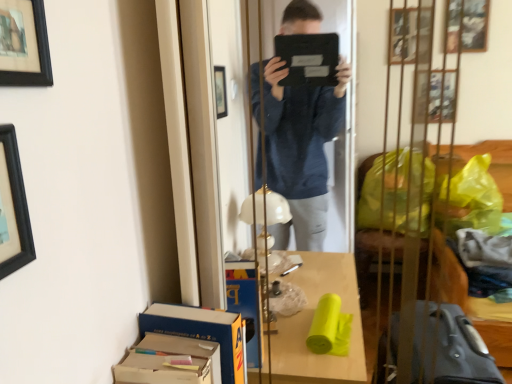
Question: From a real-world perspective, is cardboard box at lower left, arranged as the 2th cardboard box when viewed from the back, under black matte picture frame at upper left, which appears as the 1th picture frame when viewed from the top?

Choices:
 (A) yes
 (B) no

Answer: (A)

Question: Is cardboard box at lower left, arranged as the 2th cardboard box when viewed from the back, looking in the opposite direction of black matte picture frame at upper left, which appears as the 1th picture frame when viewed from the top?

Choices:
 (A) no
 (B) yes

Answer: (A)

Question: Can you confirm if cardboard box at lower left, arranged as the 2th cardboard box when viewed from the back, is positioned to the left of black matte picture frame at upper left, acting as the 2th picture frame starting from the bottom?

Choices:
 (A) no
 (B) yes

Answer: (A)

Question: Can you confirm if cardboard box at lower left, arranged as the 2th cardboard box when viewed from the back, is wider than black matte picture frame at upper left, which appears as the 1th picture frame when viewed from the top?

Choices:
 (A) yes
 (B) no

Answer: (A)

Question: Is cardboard box at lower left, arranged as the 2th cardboard box when viewed from the back, aimed at black matte picture frame at upper left, acting as the 2th picture frame starting from the bottom?

Choices:
 (A) no
 (B) yes

Answer: (A)

Question: Considering the relative positions of cardboard box at lower left, arranged as the 2th cardboard box when viewed from the back, and black matte picture frame at upper left, which appears as the 1th picture frame when viewed from the top, in the image provided, is cardboard box at lower left, arranged as the 2th cardboard box when viewed from the back, to the right of black matte picture frame at upper left, which appears as the 1th picture frame when viewed from the top, from the viewer's perspective?

Choices:
 (A) no
 (B) yes

Answer: (B)

Question: Is cardboard box at lower left, the 1th cardboard box when ordered from back to front, wider than black matte picture frame at upper left, the first picture frame positioned from the bottom?

Choices:
 (A) yes
 (B) no

Answer: (A)

Question: Is cardboard box at lower left, the 1th cardboard box when ordered from back to front, outside black matte picture frame at upper left, acting as the second picture frame starting from the top?

Choices:
 (A) no
 (B) yes

Answer: (B)

Question: From a real-world perspective, is cardboard box at lower left, the 1th cardboard box when ordered from back to front, physically below black matte picture frame at upper left, acting as the second picture frame starting from the top?

Choices:
 (A) no
 (B) yes

Answer: (B)

Question: Could you tell me if cardboard box at lower left, the 1th cardboard box when ordered from back to front, is turned towards black matte picture frame at upper left, acting as the second picture frame starting from the top?

Choices:
 (A) yes
 (B) no

Answer: (B)

Question: From the image's perspective, is cardboard box at lower left, the 1th cardboard box when ordered from back to front, below black matte picture frame at upper left, acting as the second picture frame starting from the top?

Choices:
 (A) no
 (B) yes

Answer: (B)

Question: Considering the relative sizes of cardboard box at lower left, the 2th cardboard box in the front-to-back sequence, and black matte picture frame at upper left, the first picture frame positioned from the bottom, in the image provided, is cardboard box at lower left, the 2th cardboard box in the front-to-back sequence, bigger than black matte picture frame at upper left, the first picture frame positioned from the bottom,?

Choices:
 (A) yes
 (B) no

Answer: (A)

Question: From the image's perspective, is cardboard box at lower left, the 2th cardboard box in the front-to-back sequence, on black matte picture frame at upper left, which appears as the 1th picture frame when viewed from the top?

Choices:
 (A) no
 (B) yes

Answer: (A)